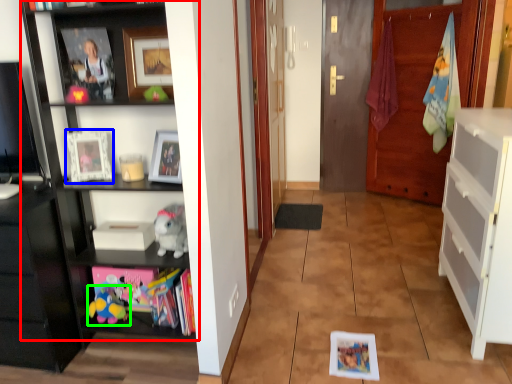
Question: Considering the real-world distances, which object is closest to shelf (highlighted by a red box)? picture frame (highlighted by a blue box) or toy (highlighted by a green box).

Choices:
 (A) picture frame
 (B) toy

Answer: (A)